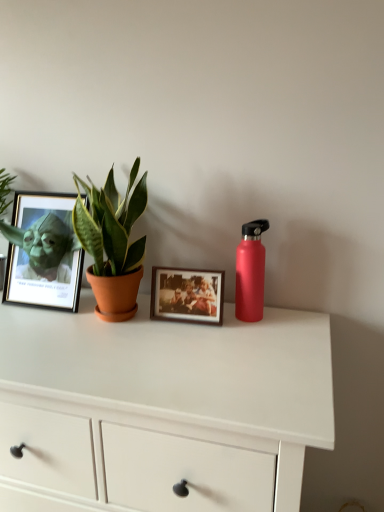
You are a GUI agent. You are given a task and a screenshot of the screen. Output one action in this format:
    pyautogui.click(x=<x>, y=<y>)
    Task: Click on the vacant space that's between green matte plant at left and matte black frame at left, which is the 1th picture frame from left to right
    The height and width of the screenshot is (512, 384).
    Given the screenshot: What is the action you would take?
    pyautogui.click(x=40, y=315)